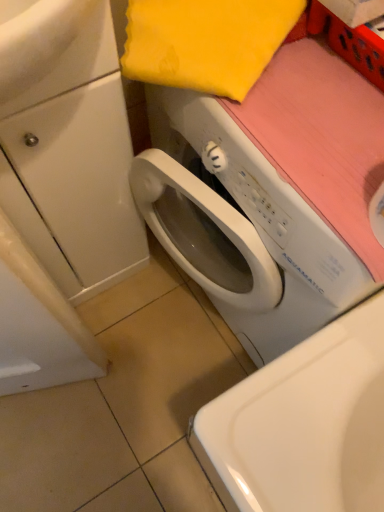
Question: Considering the positions of point click(x=150, y=136) and point click(x=51, y=212), is point click(x=150, y=136) closer or farther from the camera than point click(x=51, y=212)?

Choices:
 (A) farther
 (B) closer

Answer: (A)

Question: Based on their sizes in the image, would you say white plastic washing machine at center is bigger or smaller than white glossy cabinet at left?

Choices:
 (A) big
 (B) small

Answer: (A)

Question: Which is farther from the white glossy sink at upper left?

Choices:
 (A) white glossy cabinet at left
 (B) white plastic washing machine at center

Answer: (B)

Question: Estimate the real-world distances between objects in this image. Which object is farther from the white plastic washing machine at center?

Choices:
 (A) white glossy sink at upper left
 (B) white glossy cabinet at left

Answer: (A)